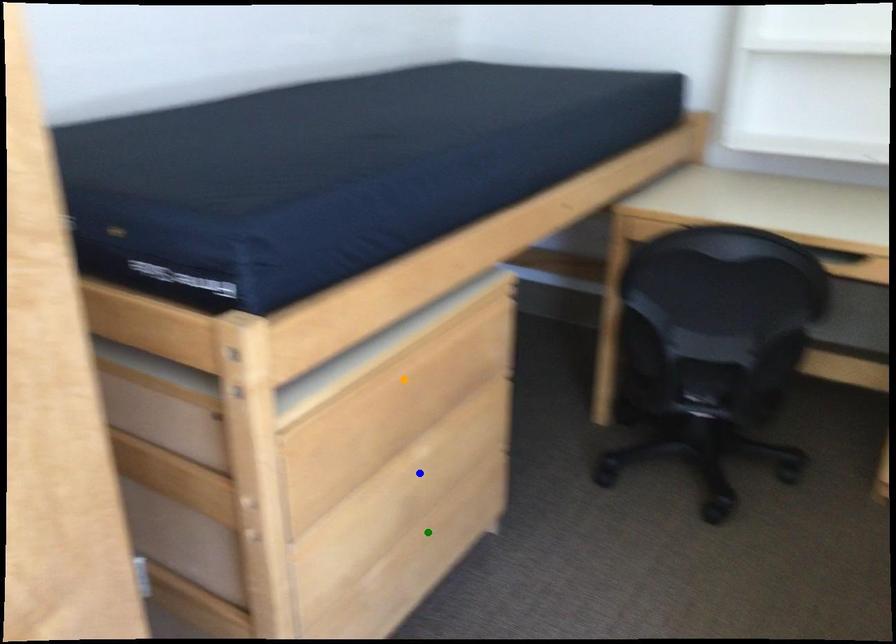
Order these from nearest to farthest:
- blue point
- green point
- orange point

orange point
blue point
green point